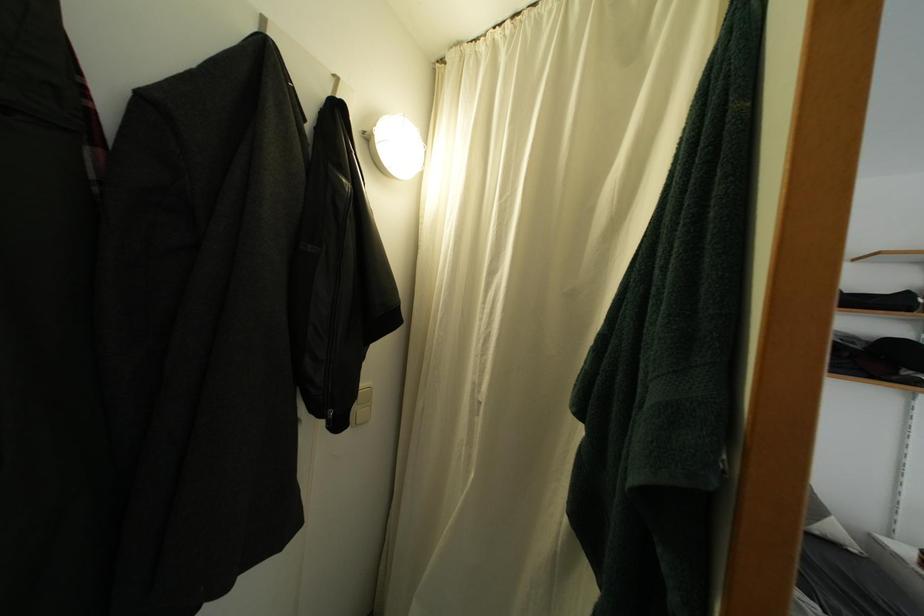
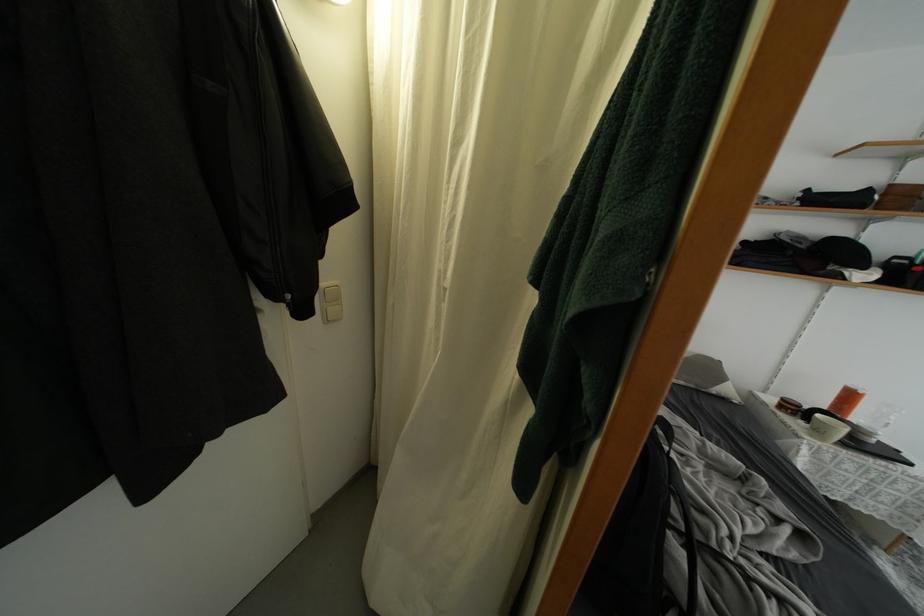
Question: What movement of the cameraman would produce the second image?

Choices:
 (A) Left
 (B) Right
 (C) Forward
 (D) Backward

Answer: (B)